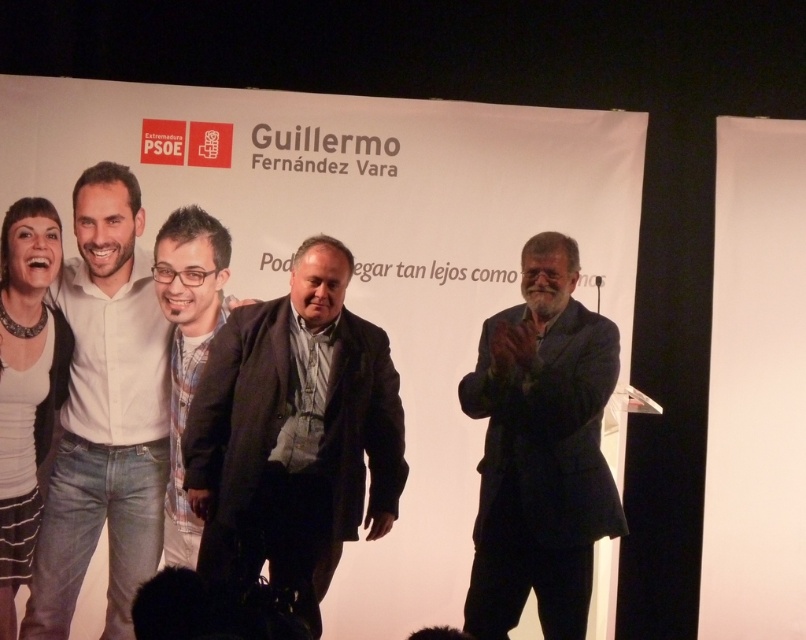
Question: Which point is farther from the camera taking this photo?

Choices:
 (A) (109, 595)
 (B) (227, 552)

Answer: (A)

Question: Can you confirm if dark blue suit at right is bigger than white shirt at left?

Choices:
 (A) yes
 (B) no

Answer: (A)

Question: Which point appears closest to the camera in this image?

Choices:
 (A) (189, 237)
 (B) (534, 465)
 (C) (310, 509)

Answer: (B)

Question: Is dark brown textured jacket at center below matte black jacket at center?

Choices:
 (A) no
 (B) yes

Answer: (B)

Question: Which point is closer to the camera?

Choices:
 (A) matte black jacket at center
 (B) dark blue suit at right

Answer: (B)

Question: Can you confirm if dark blue suit at right is positioned to the left of white shirt at left?

Choices:
 (A) no
 (B) yes

Answer: (A)